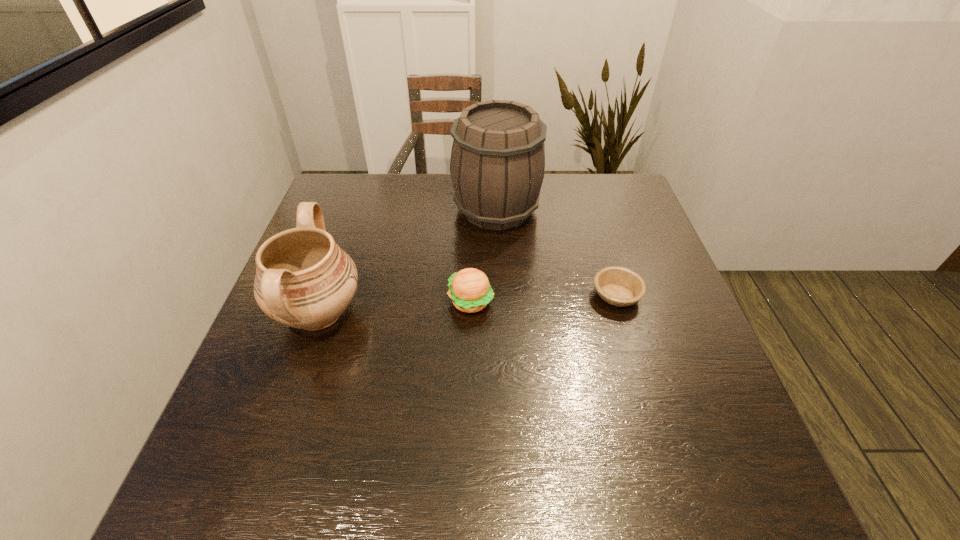
Identify the location of free spot that satisfies the following two spatial constraints: 1. on the front side of the shortest object; 2. on the front-facing side of the urn. This screenshot has height=540, width=960. (622, 313).

I want to click on free space in the image that satisfies the following two spatial constraints: 1. on the back side of the shortest object; 2. on the left side of the third tallest object, so click(471, 295).